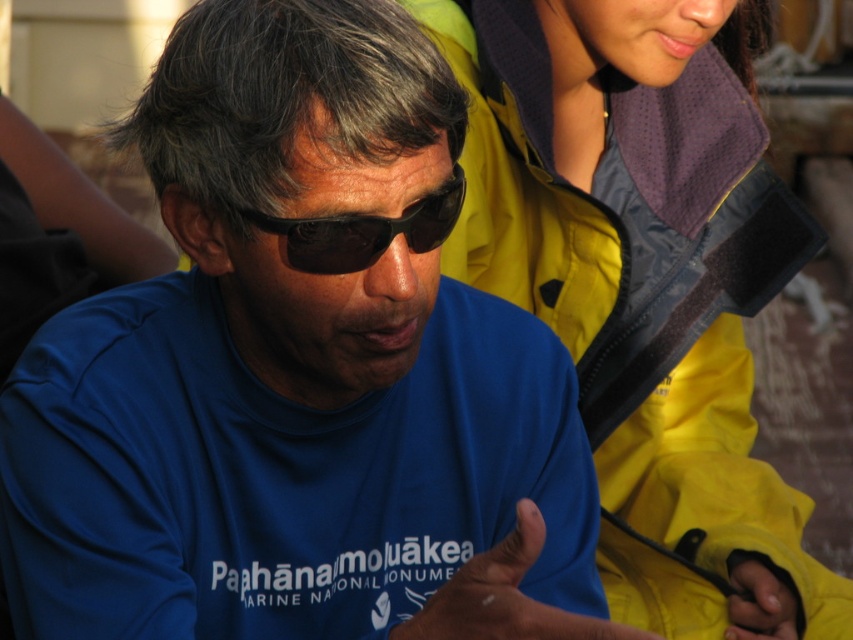
In the scene shown: Is yellow waterproof jacket at upper right to the left of yellow fabric hand at lower right from the viewer's perspective?

Yes, yellow waterproof jacket at upper right is to the left of yellow fabric hand at lower right.

Which is behind, point (735, 157) or point (750, 634)?

The point (735, 157) is behind.

Locate an element on the screen. The image size is (853, 640). yellow waterproof jacket at upper right is located at coordinates (637, 257).

Is yellow waterproof jacket at upper right above black plastic goggles at center?

No, yellow waterproof jacket at upper right is not above black plastic goggles at center.

Does yellow waterproof jacket at upper right lie behind black plastic goggles at center?

Yes, yellow waterproof jacket at upper right is further from the viewer.

Which is in front, point (637, 72) or point (415, 212)?

Positioned in front is point (415, 212).

The height and width of the screenshot is (640, 853). Identify the location of yellow waterproof jacket at upper right. (637, 257).

From the picture: Who is lower down, blue matte hand at center or black plastic goggles at center?

blue matte hand at center is below.

Is blue matte hand at center wider than black plastic goggles at center?

In fact, blue matte hand at center might be narrower than black plastic goggles at center.

The width and height of the screenshot is (853, 640). Identify the location of blue matte hand at center. (503, 596).

Locate an element on the screen. The image size is (853, 640). blue matte hand at center is located at coordinates (503, 596).